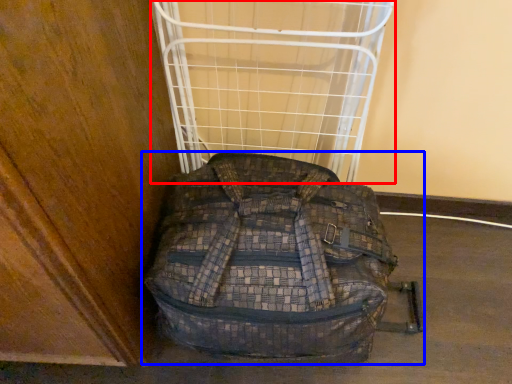
Question: Which point is further to the camera, cage (highlighted by a red box) or backpack (highlighted by a blue box)?

Choices:
 (A) cage
 (B) backpack

Answer: (A)